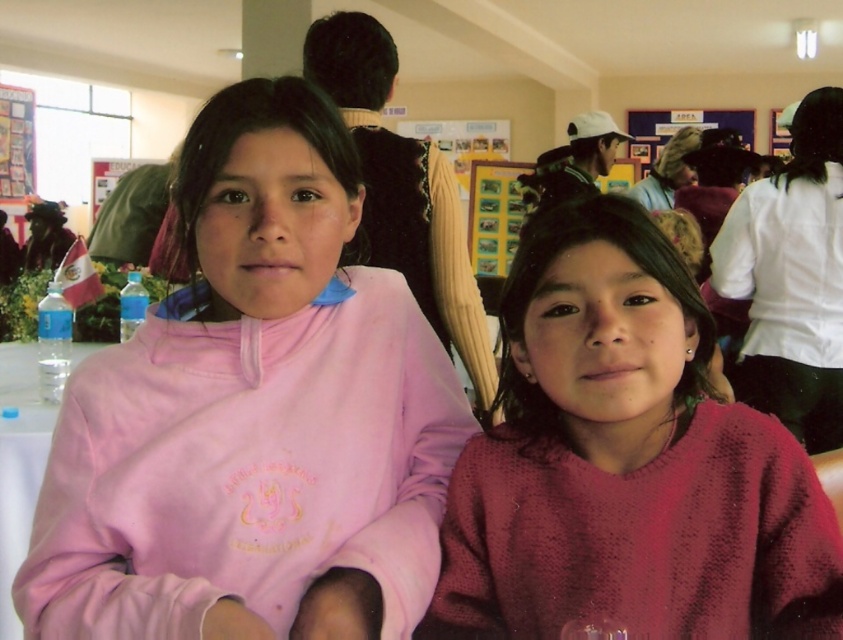
Between pink fleece jacket at center and knitted maroon sweater at center, which one is positioned lower?

knitted maroon sweater at center is below.

From the picture: Is pink fleece jacket at center wider than knitted maroon sweater at center?

Yes, pink fleece jacket at center is wider than knitted maroon sweater at center.

Who is more forward, (321, 362) or (471, 545)?

Point (321, 362)

Where is `pink fleece jacket at center`? This screenshot has height=640, width=843. pink fleece jacket at center is located at coordinates (253, 416).